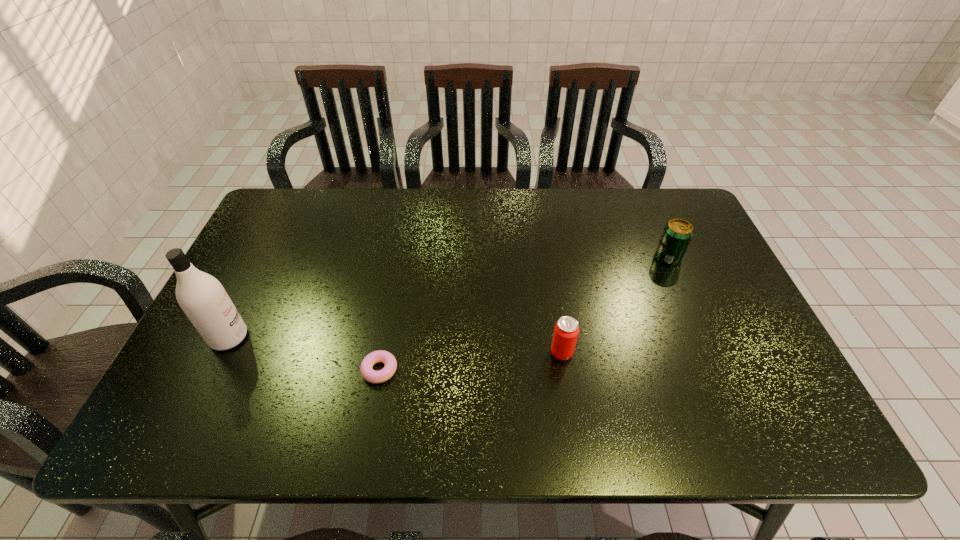
The image size is (960, 540). Identify the location of shampoo. (202, 297).

Locate an element on the screen. This screenshot has height=540, width=960. the leftmost object is located at coordinates (202, 297).

I want to click on the right beer can, so click(677, 234).

Identify the location of the farthest object. The height and width of the screenshot is (540, 960). (677, 234).

The image size is (960, 540). I want to click on the third object from left to right, so click(566, 330).

Locate an element on the screen. the nearer beer can is located at coordinates (566, 330).

Locate an element on the screen. This screenshot has width=960, height=540. the shortest object is located at coordinates (367, 372).

The image size is (960, 540). I want to click on the third object from right to left, so click(367, 372).

At what (x,y) coordinates should I click in order to perform the action: click on free space located 0.260m on the front-facing side of the shampoo. Please return your answer as a coordinate pair (x, y). The image size is (960, 540). Looking at the image, I should click on (352, 338).

Where is `free space located 0.270m on the front of the farthest object`? free space located 0.270m on the front of the farthest object is located at coordinates (706, 343).